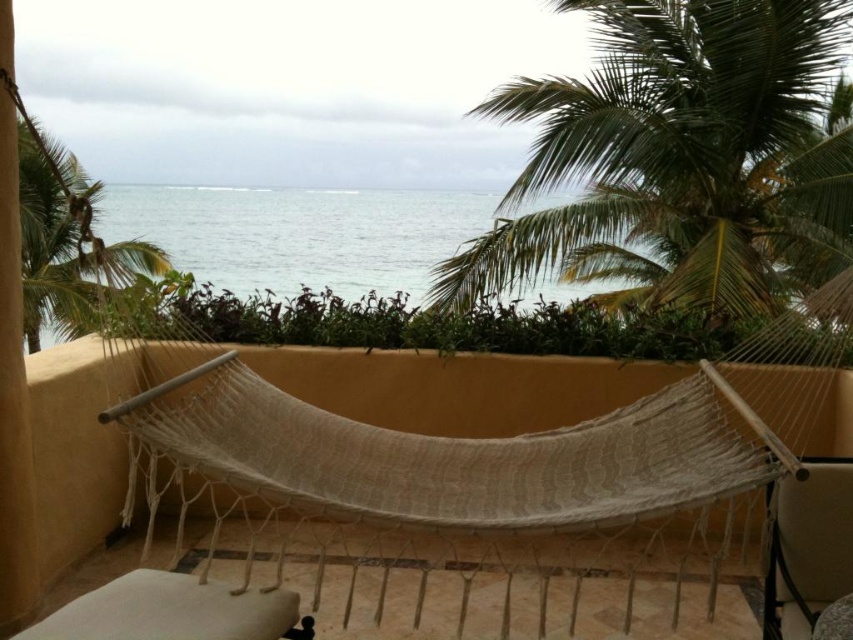
Does green leafy palm tree at upper right appear under white fabric chair at lower right?

Incorrect, green leafy palm tree at upper right is not positioned below white fabric chair at lower right.

Does green leafy palm tree at upper right have a smaller size compared to white fabric chair at lower right?

No.

Identify the location of green leafy palm tree at upper right. The height and width of the screenshot is (640, 853). (682, 157).

Which is more to the right, blue water at center or green leafy palm tree at upper left?

blue water at center is more to the right.

At what (x,y) coordinates should I click in order to perform the action: click on blue water at center. Please return your answer as a coordinate pair (x, y). Looking at the image, I should click on (300, 234).

Does point (264, 285) lie in front of point (91, 288)?

Yes, it is.

Where is `blue water at center`? The width and height of the screenshot is (853, 640). blue water at center is located at coordinates (300, 234).

Between blue water at center and white fabric chair at lower right, which one is positioned higher?

Positioned higher is blue water at center.

This screenshot has height=640, width=853. I want to click on blue water at center, so click(300, 234).